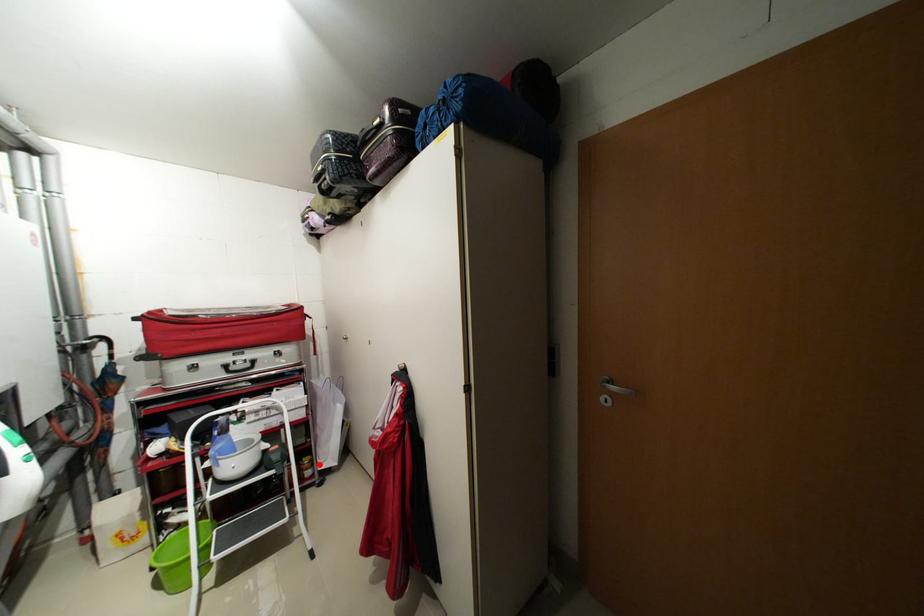
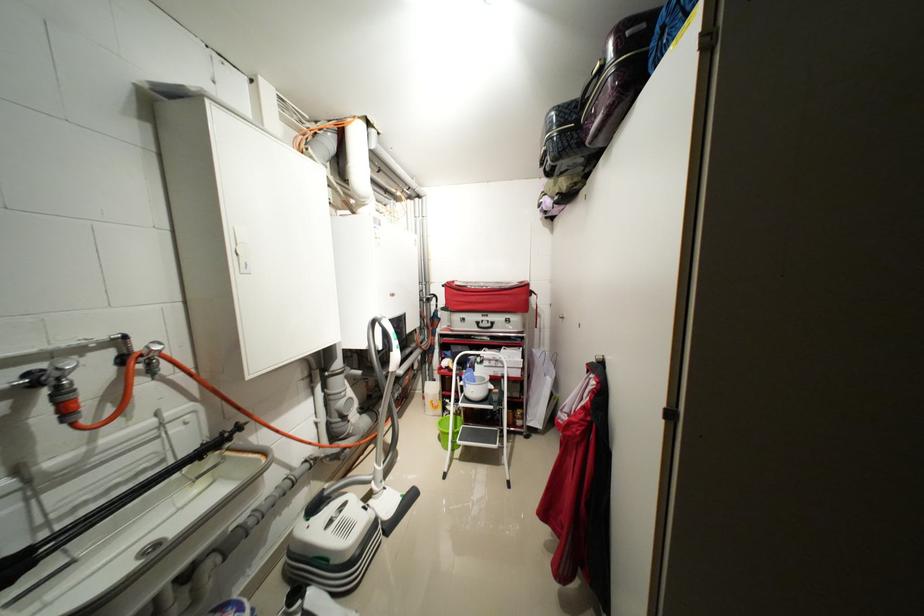
Question: I am providing you with two images of the same scene from different viewpoints. In image1, a red point is highlighted. Considering the same 3D point in image2, which of the following is correct?

Choices:
 (A) It is closer
 (B) It is farther

Answer: (B)